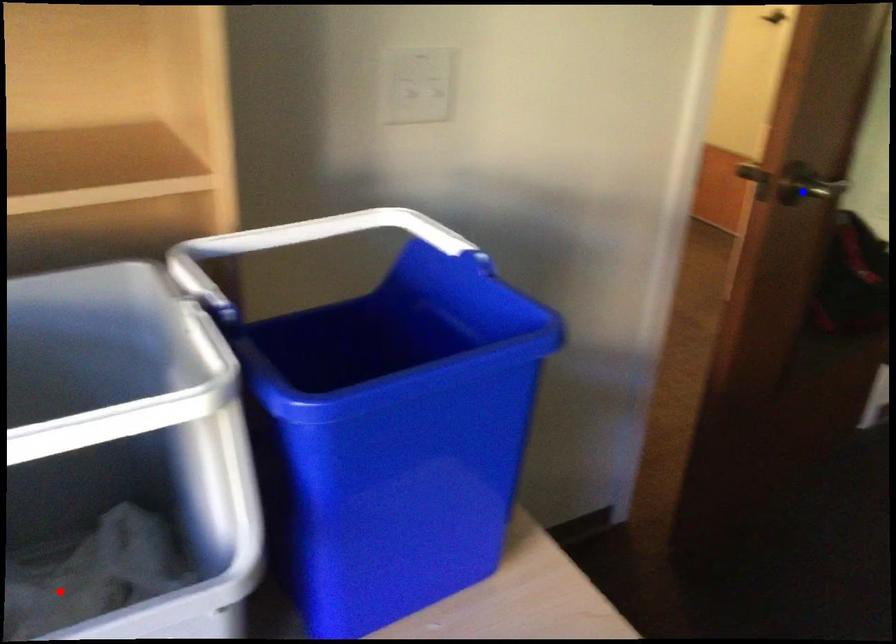
Question: Two points are marked on the image. Which point is closer to the camera?

Choices:
 (A) Blue point is closer.
 (B) Red point is closer.

Answer: (B)